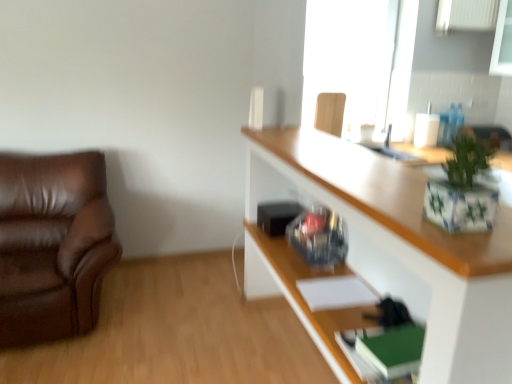
Question: Does brown leather couch at left, arranged as the second chair when viewed from the back, have a greater height compared to wooden chair at upper right, which ranks as the 2th chair in front-to-back order?

Choices:
 (A) yes
 (B) no

Answer: (A)

Question: From the image's perspective, does brown leather couch at left, arranged as the second chair when viewed from the back, appear lower than wooden chair at upper right, the 1th chair positioned from the right?

Choices:
 (A) yes
 (B) no

Answer: (A)

Question: Does brown leather couch at left, arranged as the second chair when viewed from the back, appear on the left side of wooden chair at upper right, which is the second chair in left-to-right order?

Choices:
 (A) no
 (B) yes

Answer: (B)

Question: Can you confirm if brown leather couch at left, arranged as the first chair when viewed from the front, is shorter than wooden chair at upper right, which ranks as the 2th chair in front-to-back order?

Choices:
 (A) yes
 (B) no

Answer: (B)

Question: Considering the relative sizes of brown leather couch at left, the second chair when ordered from right to left, and wooden chair at upper right, which ranks as the 1th chair in top-to-bottom order, in the image provided, is brown leather couch at left, the second chair when ordered from right to left, smaller than wooden chair at upper right, which ranks as the 1th chair in top-to-bottom order,?

Choices:
 (A) no
 (B) yes

Answer: (A)

Question: From a real-world perspective, is brown leather couch at left, arranged as the second chair when viewed from the back, positioned over wooden chair at upper right, which ranks as the 2th chair in front-to-back order, based on gravity?

Choices:
 (A) yes
 (B) no

Answer: (B)

Question: Would you say green ceramic pot at upper right is part of brown leather couch at left, the 1th chair when ordered from bottom to top,'s contents?

Choices:
 (A) no
 (B) yes

Answer: (A)

Question: Is brown leather couch at left, arranged as the second chair when viewed from the back, aimed at green ceramic pot at upper right?

Choices:
 (A) yes
 (B) no

Answer: (B)

Question: Are brown leather couch at left, which is the 2th chair from top to bottom, and green ceramic pot at upper right beside each other?

Choices:
 (A) no
 (B) yes

Answer: (A)

Question: From a real-world perspective, is brown leather couch at left, which is the 2th chair from top to bottom, positioned over green ceramic pot at upper right based on gravity?

Choices:
 (A) yes
 (B) no

Answer: (B)

Question: Does brown leather couch at left, which is the 2th chair from top to bottom, have a greater width compared to green ceramic pot at upper right?

Choices:
 (A) yes
 (B) no

Answer: (A)

Question: From the image's perspective, is brown leather couch at left, arranged as the second chair when viewed from the back, beneath green ceramic pot at upper right?

Choices:
 (A) yes
 (B) no

Answer: (A)

Question: Considering the relative positions of transparent glass window at upper center and white glossy cabinet at upper right in the image provided, is transparent glass window at upper center to the right of white glossy cabinet at upper right from the viewer's perspective?

Choices:
 (A) yes
 (B) no

Answer: (A)